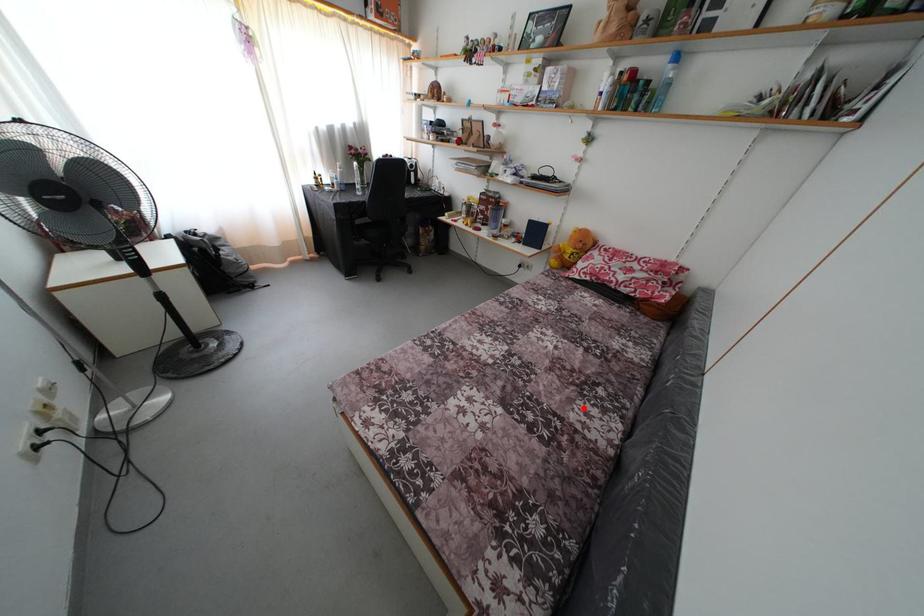
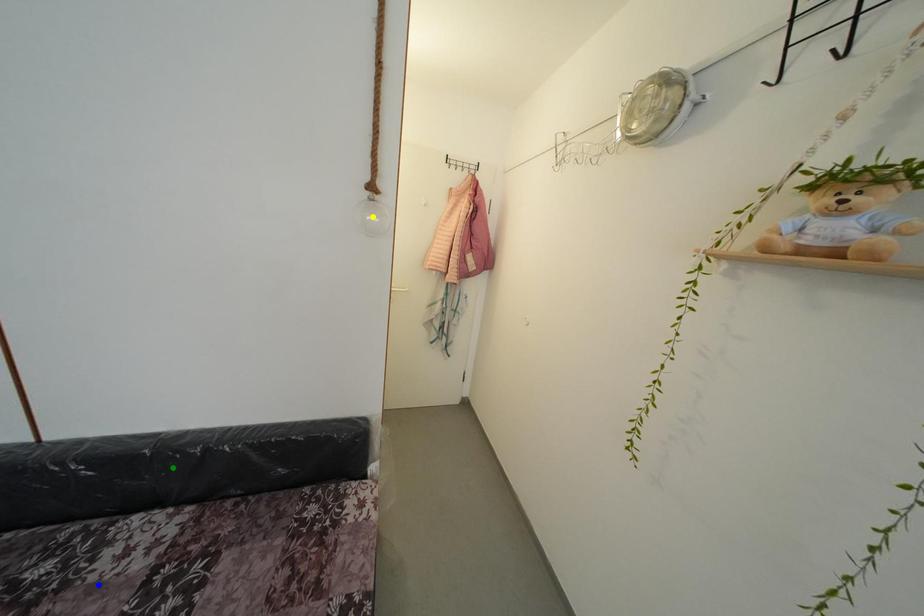
Question: I am providing you with two images of the same scene from different viewpoints. A red point is marked on the first image. You are given multiple points on the second image. Which spot in image 2 lines up with the point in image 1?

Choices:
 (A) green point
 (B) yellow point
 (C) blue point

Answer: (C)